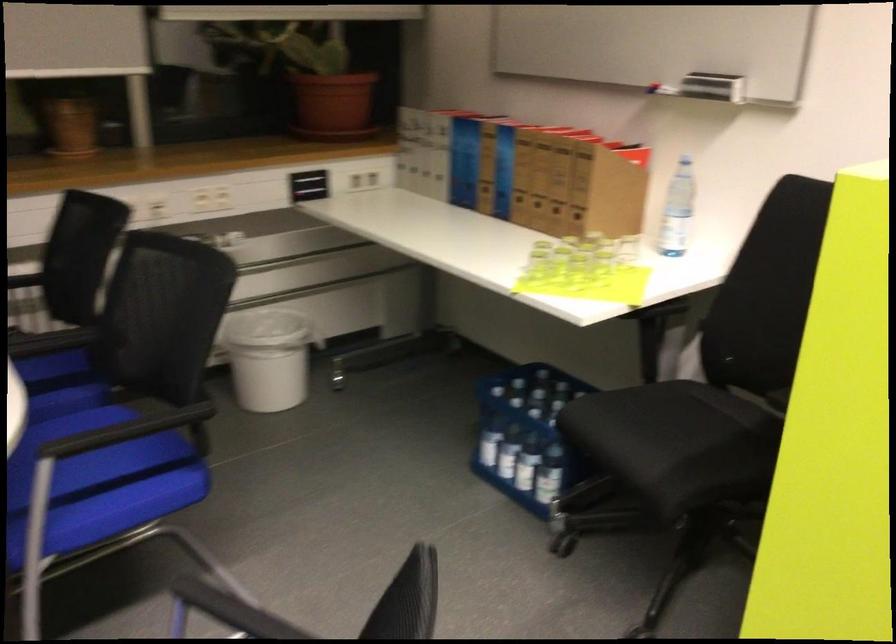
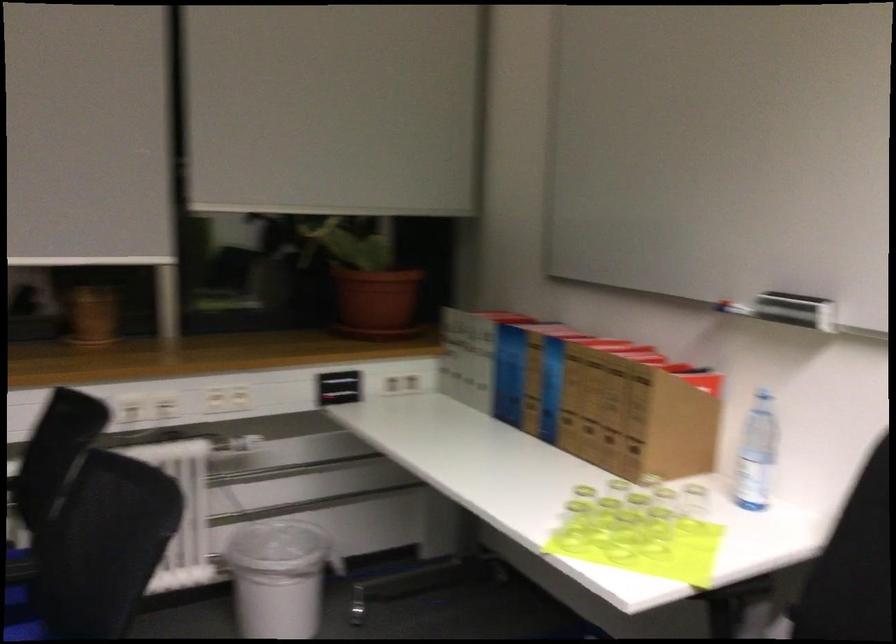
Locate, in the second image, the point that corresponds to point (309, 187) in the first image.

(339, 386)